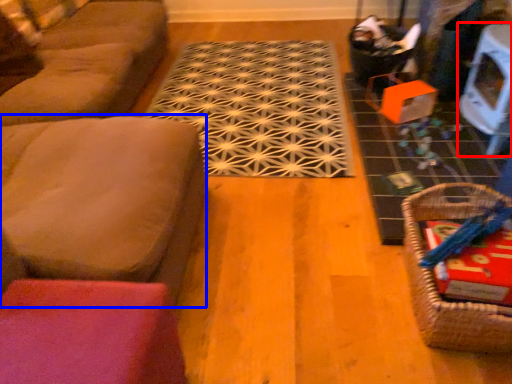
Question: Which object is closer to the camera taking this photo, table (highlighted by a red box) or couch (highlighted by a blue box)?

Choices:
 (A) table
 (B) couch

Answer: (B)